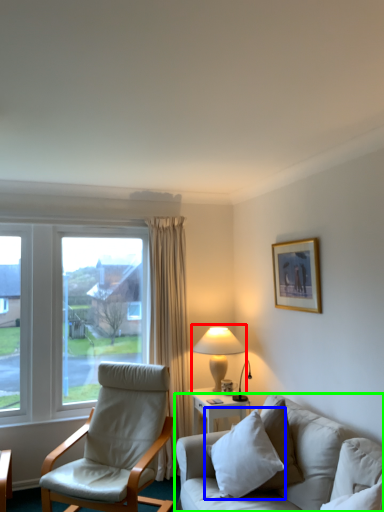
Question: Which object is positioned closest to table lamp (highlighted by a red box)? Select from pillow (highlighted by a blue box) and studio couch (highlighted by a green box).

Choices:
 (A) pillow
 (B) studio couch

Answer: (A)